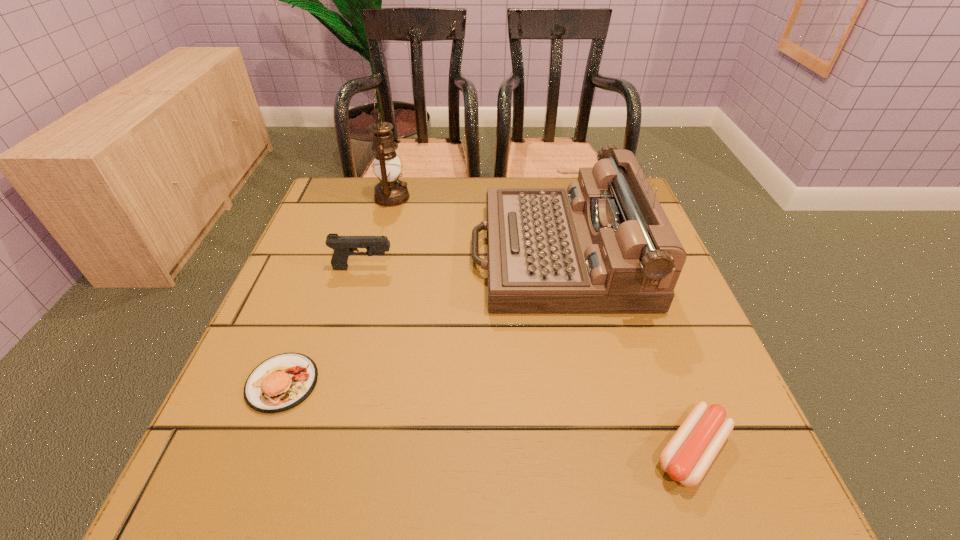
At what (x,y) coordinates should I click in order to perform the action: click on blank region between the tallest object and the shortest object. Please return your answer as a coordinate pair (x, y). Looking at the image, I should click on (541, 324).

Find the location of `vacant area between the tallest object and the second shortest object`. vacant area between the tallest object and the second shortest object is located at coordinates (x=337, y=290).

You are a GUI agent. You are given a task and a screenshot of the screen. Output one action in this format:
    pyautogui.click(x=<x>, y=<y>)
    Task: Click on the free space between the patty and the tallest object
    
    Given the screenshot: What is the action you would take?
    pyautogui.click(x=337, y=290)

This screenshot has width=960, height=540. Identify the location of free spot between the patty and the fourth shortest object. (420, 319).

Where is `vacant point located between the sausage and the typewriter`? vacant point located between the sausage and the typewriter is located at coordinates (624, 353).

Locate an element on the screen. This screenshot has height=540, width=960. unoccupied position between the patty and the third shortest object is located at coordinates (323, 326).

Identify the location of vacant region between the pistol and the typewriter. This screenshot has width=960, height=540. (460, 261).

Identify the location of vacant area that lies between the third tallest object and the typewriter. [x=460, y=261].

You are a GUI agent. You are given a task and a screenshot of the screen. Output one action in this format:
    pyautogui.click(x=<x>, y=<y>)
    Task: Click on the fourth closest object to the pistol
    This screenshot has width=960, height=540.
    Given the screenshot: What is the action you would take?
    pyautogui.click(x=688, y=455)

Locate an element on the screen. This screenshot has height=540, width=960. object that is the second nearest to the shortest object is located at coordinates (281, 382).